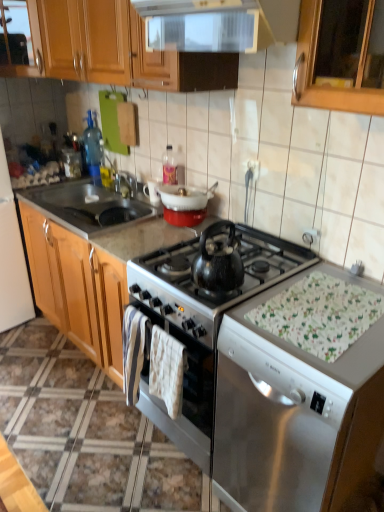
You are a GUI agent. You are given a task and a screenshot of the screen. Output one action in this format:
    pyautogui.click(x=<x>, y=<y>)
    Task: Click on the free space above white glossy dishwasher at lower right (from a real-world perspective)
    The image size is (384, 512).
    Given the screenshot: What is the action you would take?
    pyautogui.click(x=330, y=309)